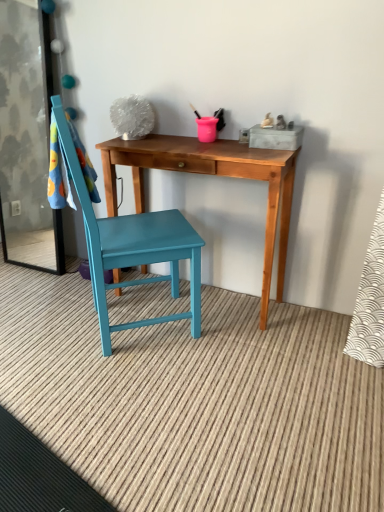
Find the location of a particular element. The image size is (384, 512). blank space to the left of wooden desk at center is located at coordinates (52, 315).